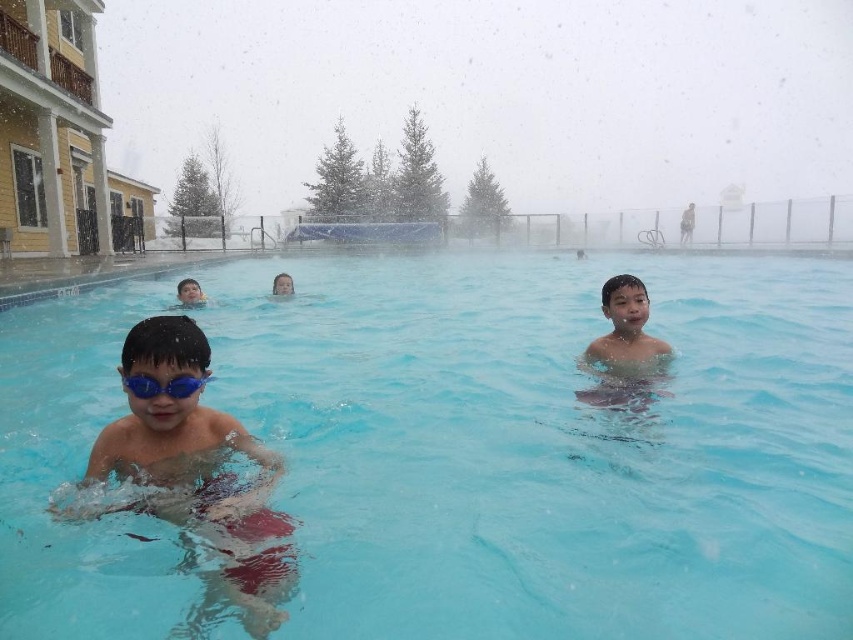
You are a lifeguard standing at the edge of the pool. You need to retrieve the blue matte goggles at center because they belong to a child. The smooth skin boy at center is in the water. Can you reach the goggles without entering the water if your pool net has a 3 meter reach?

The distance between the smooth skin boy at center and the blue matte goggles at center is 3.04 meters. Since the pool net can only reach 3 meters, you cannot retrieve the goggles without entering the water.

Based on the photo, you are a photographer trying to capture a closeup of the smooth skin boy at center and blue matte goggles at center. Which object will appear wider in the photo?

The smooth skin boy at center will appear wider in the photo because its width surpasses that of the blue matte goggles at center.